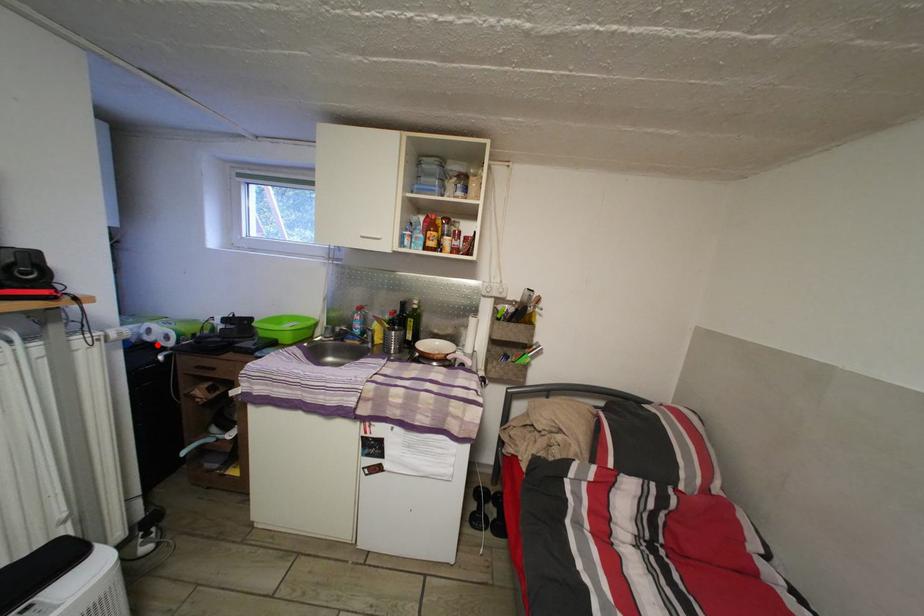
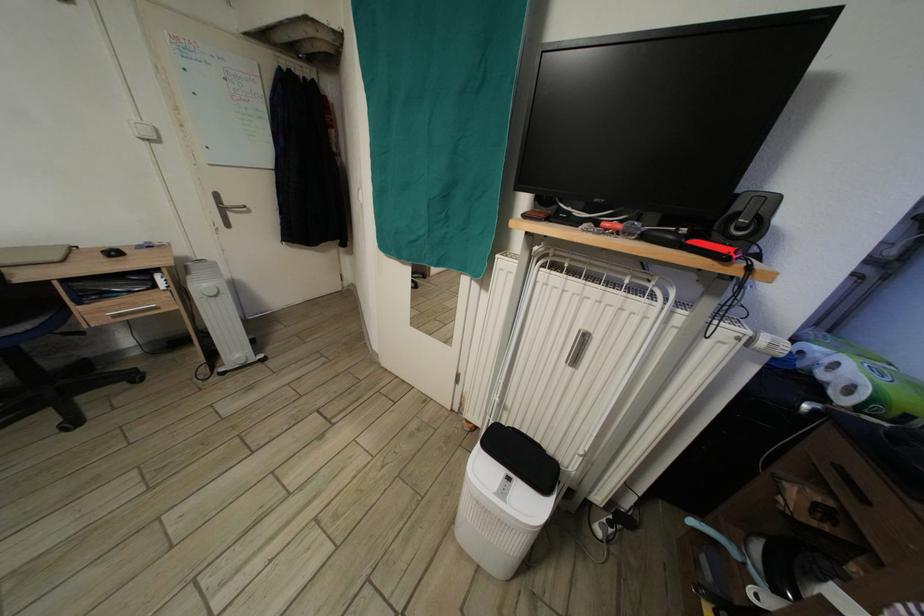
The point at the highlighted location is marked in the first image. Where is the corresponding point in the second image?

(830, 383)